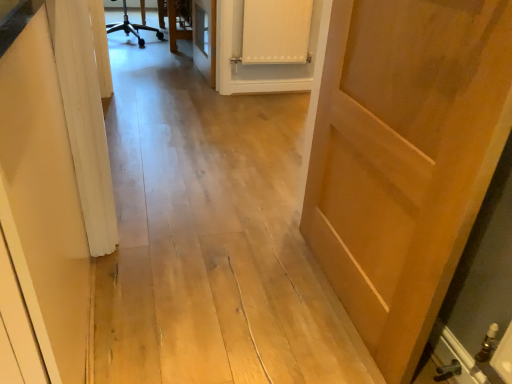
Identify the location of vacant location below white matte cabinet at upper center (from a real-world perspective). The height and width of the screenshot is (384, 512). (278, 87).